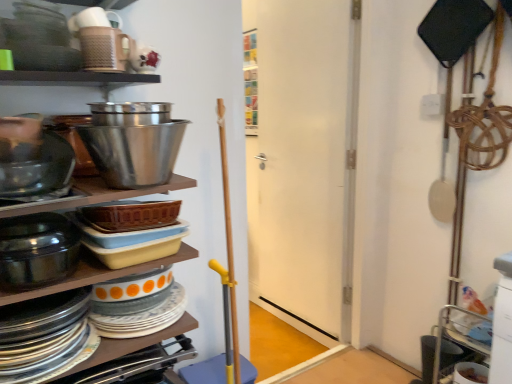
Question: Is shiny metallic bowl at left, positioned as the first bowl in bottom-to-top order, closer to camera compared to shiny metallic bowl at upper center, arranged as the 3th bowl when ordered from the bottom?

Choices:
 (A) yes
 (B) no

Answer: (A)

Question: Is shiny metallic bowl at left, positioned as the first bowl in bottom-to-top order, thinner than shiny metallic bowl at upper center, marked as the 1th bowl in a top-to-bottom arrangement?

Choices:
 (A) yes
 (B) no

Answer: (A)

Question: Is shiny metallic bowl at left, the third bowl in the top-to-bottom sequence, wider than shiny metallic bowl at upper center, arranged as the 3th bowl when ordered from the bottom?

Choices:
 (A) no
 (B) yes

Answer: (A)

Question: Does shiny metallic bowl at left, the third bowl in the top-to-bottom sequence, have a greater height compared to shiny metallic bowl at upper center, arranged as the 3th bowl when ordered from the bottom?

Choices:
 (A) yes
 (B) no

Answer: (B)

Question: From the image's perspective, is shiny metallic bowl at left, the third bowl in the top-to-bottom sequence, located above shiny metallic bowl at upper center, marked as the 1th bowl in a top-to-bottom arrangement?

Choices:
 (A) yes
 (B) no

Answer: (B)

Question: Do you think matte ceramic dishes at left is within white matte door at center, or outside of it?

Choices:
 (A) outside
 (B) inside

Answer: (A)

Question: Based on their positions, is matte ceramic dishes at left located to the left or right of white matte door at center?

Choices:
 (A) left
 (B) right

Answer: (A)

Question: In terms of size, does matte ceramic dishes at left appear bigger or smaller than white matte door at center?

Choices:
 (A) small
 (B) big

Answer: (A)

Question: From the image's perspective, relative to white matte door at center, is matte ceramic dishes at left above or below?

Choices:
 (A) above
 (B) below

Answer: (B)

Question: Considering their positions, is matte ceramic dishes at left located in front of or behind matte black bowl at left, acting as the 2th bowl starting from the bottom?

Choices:
 (A) behind
 (B) front

Answer: (B)

Question: Would you say matte ceramic dishes at left is to the left or to the right of matte black bowl at left, acting as the 2th bowl starting from the bottom, in the picture?

Choices:
 (A) left
 (B) right

Answer: (B)

Question: In terms of width, does matte ceramic dishes at left look wider or thinner when compared to matte black bowl at left, acting as the 2th bowl starting from the bottom?

Choices:
 (A) thin
 (B) wide

Answer: (B)

Question: From a real-world perspective, is matte ceramic dishes at left positioned above or below matte black bowl at left, acting as the 2th bowl starting from the bottom?

Choices:
 (A) above
 (B) below

Answer: (B)

Question: Considering the positions of shiny metallic bowl at left, the third bowl in the top-to-bottom sequence, and white matte door at center in the image, is shiny metallic bowl at left, the third bowl in the top-to-bottom sequence, taller or shorter than white matte door at center?

Choices:
 (A) short
 (B) tall

Answer: (A)

Question: From the image's perspective, is shiny metallic bowl at left, positioned as the first bowl in bottom-to-top order, located above or below white matte door at center?

Choices:
 (A) below
 (B) above

Answer: (A)